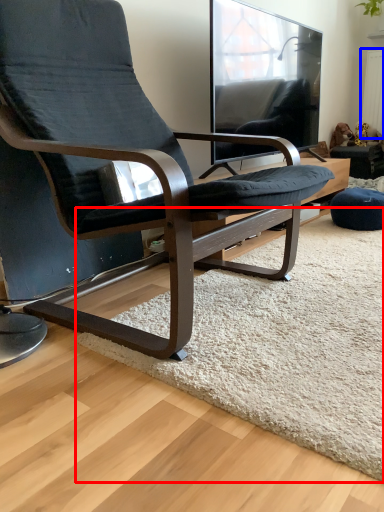
Question: Which object is further to the camera taking this photo, mat (highlighted by a red box) or radiator (highlighted by a blue box)?

Choices:
 (A) mat
 (B) radiator

Answer: (B)